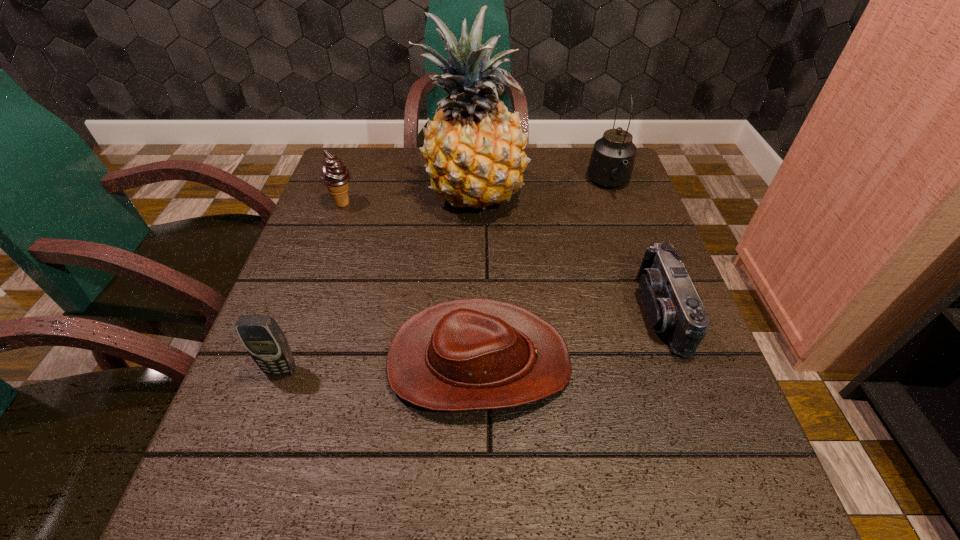
Locate which object is the third closest to the icecream. Please provide its 2D coordinates. Your answer should be formatted as a tuple, i.e. [(x, y)], where the tuple contains the x and y coordinates of a point satisfying the conditions above.

[(262, 337)]

In order to click on free space that satisfies the following two spatial constraints: 1. on the front-facing side of the shortest object; 2. on the front face of the cellular telephone in this screenshot , I will do `click(479, 370)`.

Image resolution: width=960 pixels, height=540 pixels. What are the coordinates of `free location that satisfies the following two spatial constraints: 1. on the front-facing side of the cowboy hat; 2. on the front face of the cellular telephone` in the screenshot? It's located at (479, 370).

Locate an element on the screen. The image size is (960, 540). vacant region that satisfies the following two spatial constraints: 1. spout on the kettle; 2. on the front-facing side of the shortest object is located at coordinates (673, 361).

Find the location of a particular element. The height and width of the screenshot is (540, 960). vacant region that satisfies the following two spatial constraints: 1. spout on the fifth shortest object; 2. on the front-facing side of the cowboy hat is located at coordinates (673, 361).

The height and width of the screenshot is (540, 960). In order to click on blank space that satisfies the following two spatial constraints: 1. on the front-facing side of the fifth tallest object; 2. on the front face of the cellular telephone in this screenshot , I will do `click(683, 370)`.